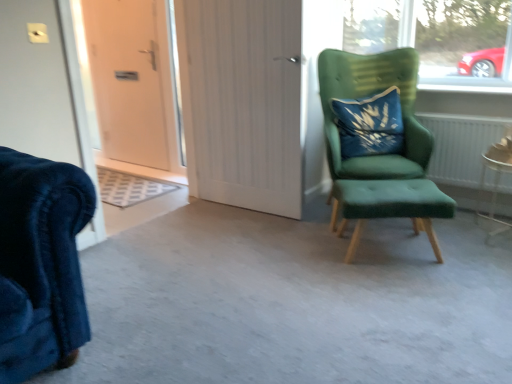
The image size is (512, 384). I want to click on vacant area situated below metallic silver side table at lower right (from a real-world perspective), so click(x=490, y=231).